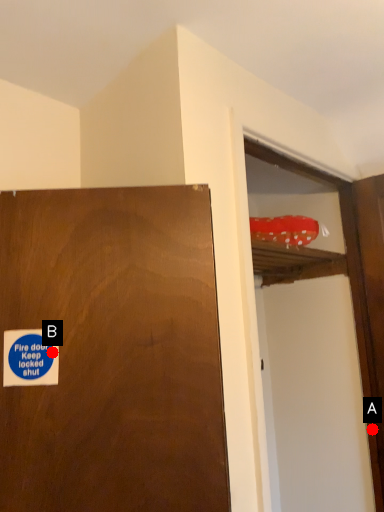
Question: Two points are circled on the image, labeled by A and B beside each circle. Which of the following is the closest to the observer?

Choices:
 (A) A is closer
 (B) B is closer

Answer: (B)